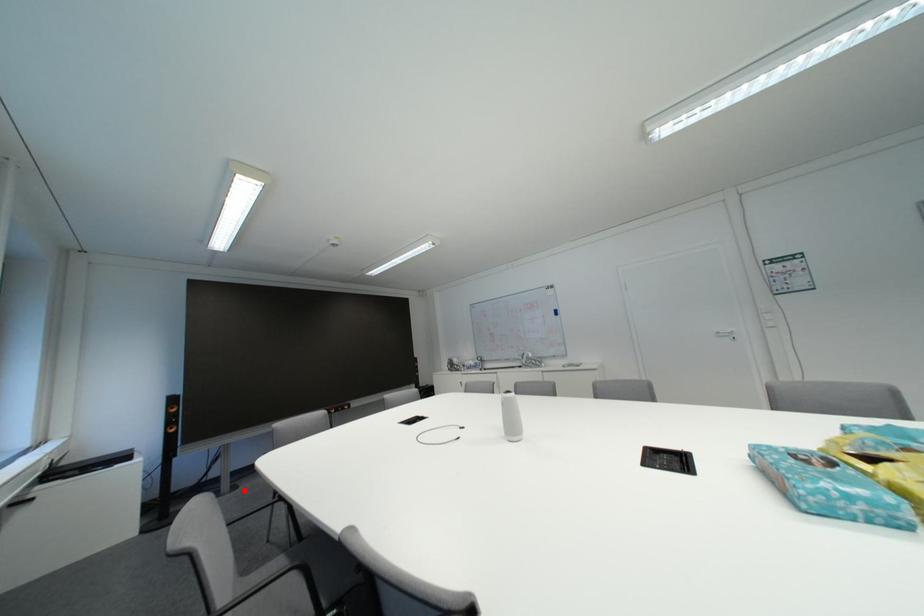
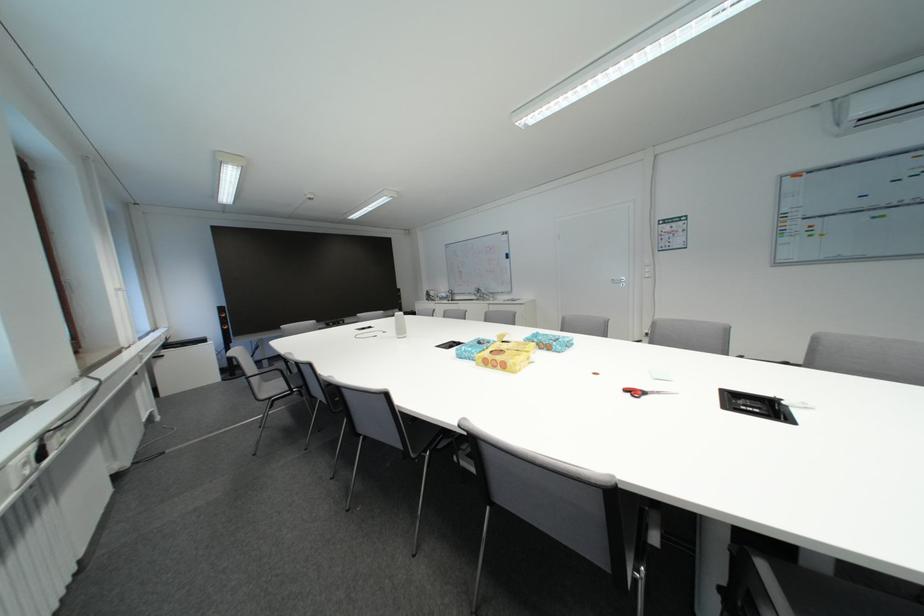
Question: I am providing you with two images of the same scene from different viewpoints. In image1, a red point is highlighted. Considering the same 3D point in image2, which of the following is correct?

Choices:
 (A) It is closer
 (B) It is farther

Answer: (B)